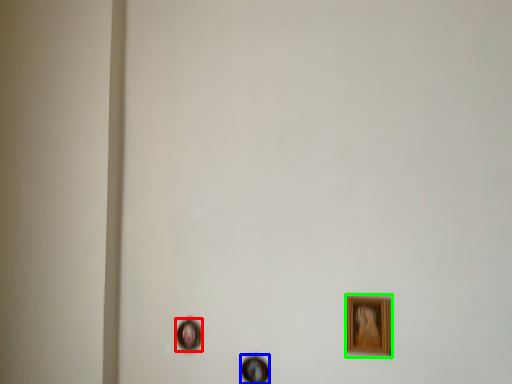
Question: Which object is positioned closest to picture frame (highlighted by a red box)? Select from picture frame (highlighted by a blue box) and picture frame (highlighted by a green box).

Choices:
 (A) picture frame
 (B) picture frame

Answer: (A)